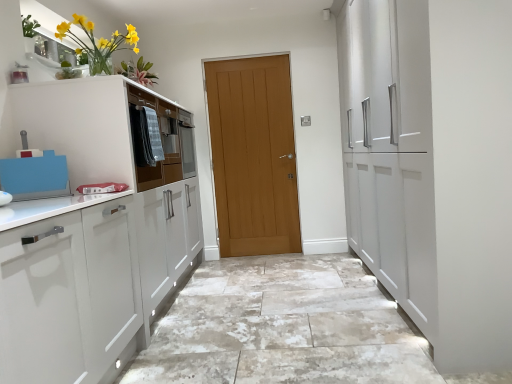
Locate an element on the screen. Image resolution: width=512 pixels, height=384 pixels. free space above light brown wooden door at center (from a real-world perspective) is located at coordinates (246, 56).